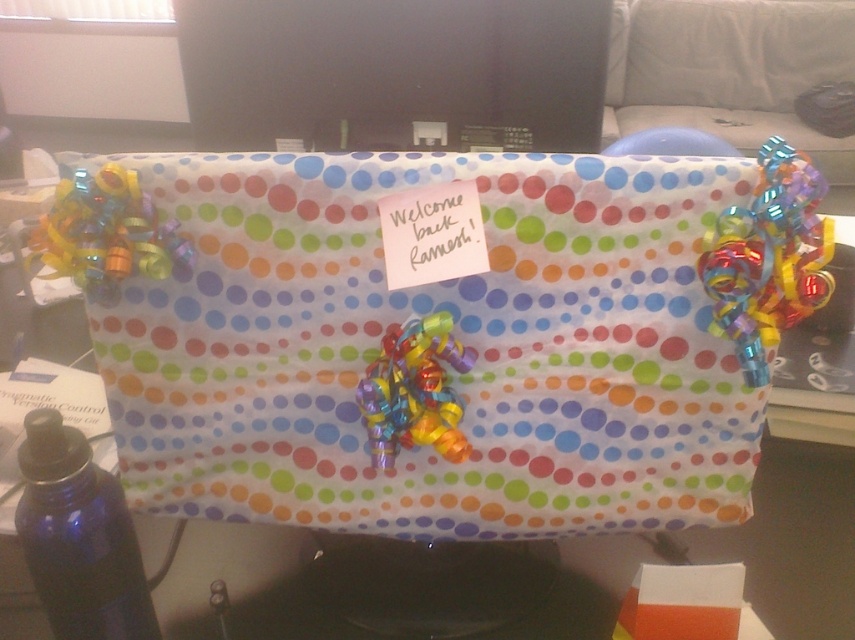
What are the coordinates of the polka dot wrapping paper at center?

The coordinates of the polka dot wrapping paper at center are at point (x=370, y=362).

You are looking at the desk setup and want to place a small sticker on the monitor. You have two points marked on the monitor where you can choose to place it. The points are at coordinates point (624, 461) and point (34, 515). Which point is closer to the camera so that the sticker will be more visible?

Point (624, 461) is further to the camera than point (34, 515), so placing the sticker at point (624, 461) would make it more visible since it is closer to the camera.

You are organizing a surprise party for Ramesh and need to place a 6.5 inch wide cake on the desk. The cake must be placed between the polka dot wrapping paper at center and the blue glass bottle at lower left. Is there enough space for the cake?

The distance between the polka dot wrapping paper at center and the blue glass bottle at lower left is 7.01 inches. Since the cake is 6.5 inches wide, there is enough space to place it between them.